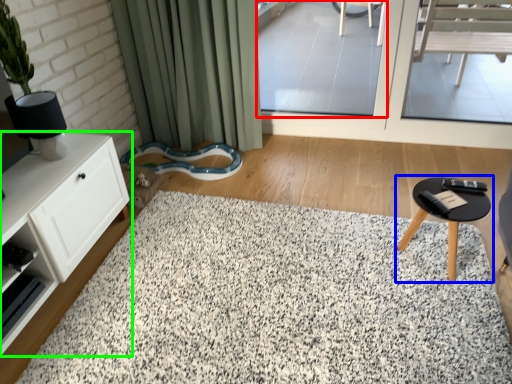
Question: Considering the real-world distances, which object is closest to window screen (highlighted by a red box)? table (highlighted by a blue box) or cabinetry (highlighted by a green box).

Choices:
 (A) table
 (B) cabinetry

Answer: (A)